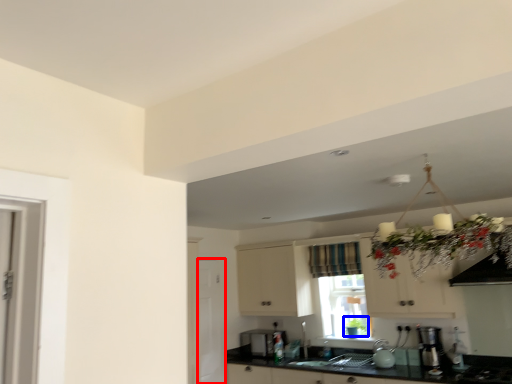
Question: Which point is further to the camera, screen door (highlighted by a red box) or plant (highlighted by a blue box)?

Choices:
 (A) screen door
 (B) plant

Answer: (B)